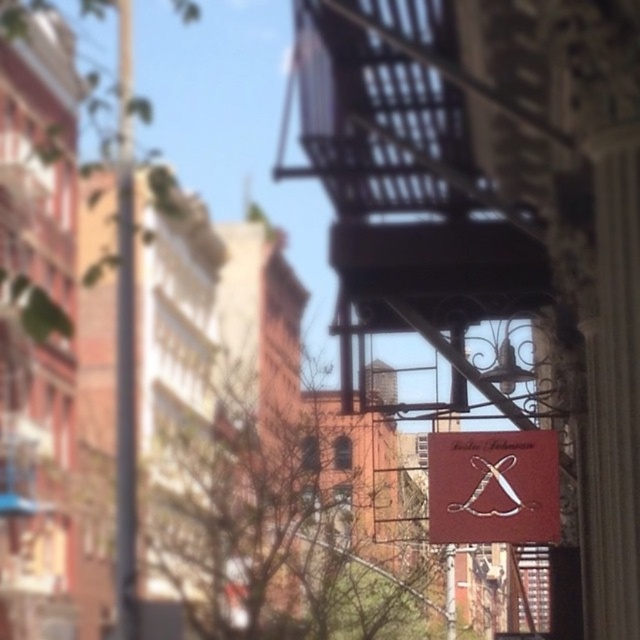
Question: Is maroon leather sign at center smaller than metallic pole at left?

Choices:
 (A) no
 (B) yes

Answer: (B)

Question: Is maroon leather sign at center positioned behind metallic pole at left?

Choices:
 (A) no
 (B) yes

Answer: (A)

Question: Which point is closer to the camera?

Choices:
 (A) (120, 216)
 (B) (556, 476)

Answer: (B)

Question: Can you confirm if maroon leather sign at center is positioned to the left of metallic pole at left?

Choices:
 (A) yes
 (B) no

Answer: (B)

Question: Which object is farther from the camera taking this photo?

Choices:
 (A) metallic pole at left
 (B) maroon leather sign at center

Answer: (A)

Question: Which object appears closest to the camera in this image?

Choices:
 (A) metallic pole at left
 (B) maroon leather sign at center

Answer: (B)